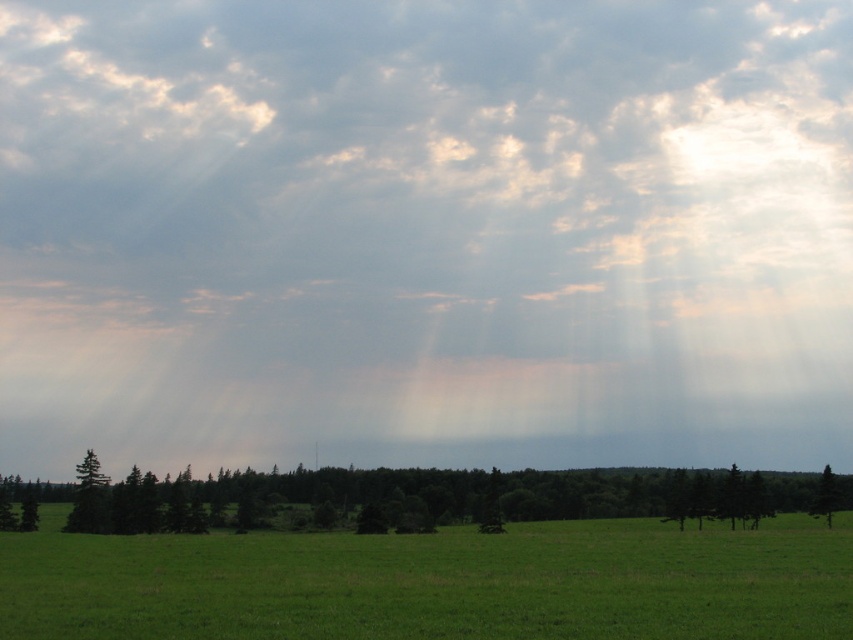
You are standing at the origin point of the image and looking towards the horizon. You see two points marked in the scene. Which point is closer to you, point (x=721, y=506) or point (x=76, y=497)?

Point (x=76, y=497) is closer to you because it is in front of point (x=721, y=506), which is behind it.

You are a hiker standing in the middle of the green field. You see the green matte tree at lower center and the green matte tree at lower right. Which tree would appear closer to you?

The green matte tree at lower center is bigger than the green matte tree at lower right, so it would appear closer to you.

Consider the image. You are standing in the middle of the green field in the scene. You see the green matte tree at lower center. Based on its position, can you determine if it is closer to you or further away compared to the dense line of trees in the midground?

The green matte tree at lower center is located at point (403, 497), which places it closer to the viewer than the dense line of trees in the midground. Therefore, it is closer to you.